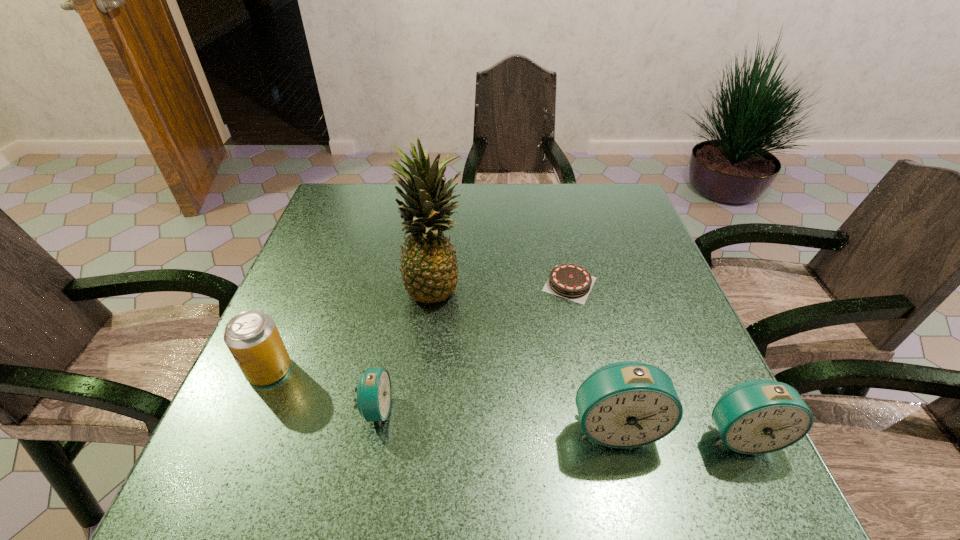
The width and height of the screenshot is (960, 540). What are the coordinates of `the fifth tallest object` in the screenshot? It's located at (374, 392).

Locate an element on the screen. Image resolution: width=960 pixels, height=540 pixels. the leftmost alarm clock is located at coordinates (374, 392).

I want to click on the second alarm clock from left to right, so click(x=627, y=404).

Locate an element on the screen. the rightmost alarm clock is located at coordinates (760, 416).

Identify the location of the rightmost object. The height and width of the screenshot is (540, 960). (760, 416).

In order to click on the shortest object in this screenshot , I will do `click(569, 281)`.

I want to click on pop (soda), so click(252, 337).

What are the coordinates of `the tallest object` in the screenshot? It's located at (429, 269).

This screenshot has width=960, height=540. Identify the location of free space located on the front-facing side of the leftmost alarm clock. click(x=511, y=409).

Locate an element on the screen. This screenshot has height=540, width=960. free space located 0.370m on the left of the chocolate cake is located at coordinates point(388,284).